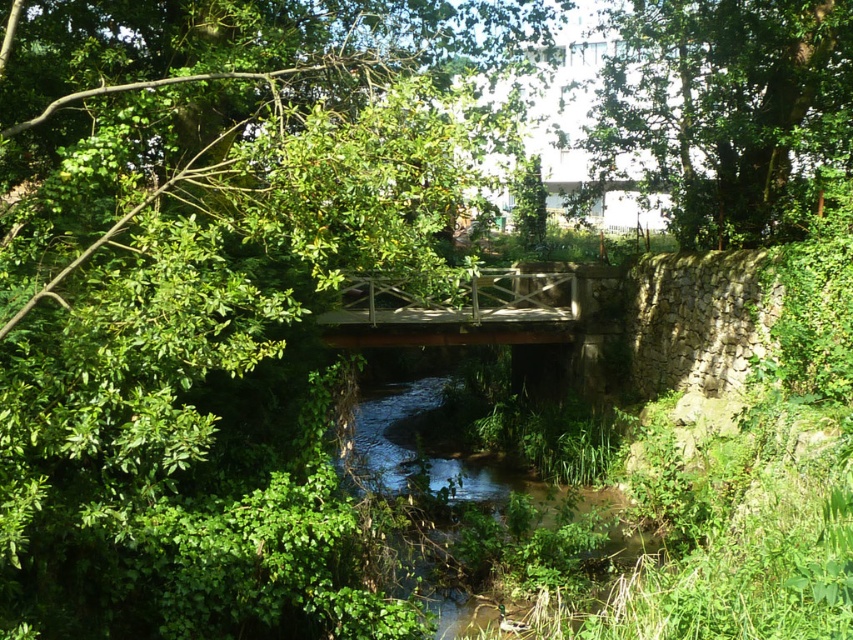
Does point (22, 44) come in front of point (761, 61)?

Yes.

Is green leafy tree at center below green leafy tree at upper center?

Indeed, green leafy tree at center is positioned under green leafy tree at upper center.

Is point (131, 1) closer to camera compared to point (637, 147)?

Yes, it is.

At what (x,y) coordinates should I click in order to perform the action: click on green leafy tree at center. Please return your answer as a coordinate pair (x, y). Image resolution: width=853 pixels, height=640 pixels. Looking at the image, I should click on (210, 291).

Does green leafy tree at upper center have a greater width compared to wooden bridge at center?

No, green leafy tree at upper center is not wider than wooden bridge at center.

Which is above, green leafy tree at upper center or wooden bridge at center?

Positioned higher is green leafy tree at upper center.

Describe the element at coordinates (730, 109) in the screenshot. The height and width of the screenshot is (640, 853). I see `green leafy tree at upper center` at that location.

At what (x,y) coordinates should I click in order to perform the action: click on green leafy tree at upper center. Please return your answer as a coordinate pair (x, y). Looking at the image, I should click on (730, 109).

Can you confirm if green leafy tree at center is positioned below wooden bridge at center?

Incorrect, green leafy tree at center is not positioned below wooden bridge at center.

Can you confirm if green leafy tree at center is positioned above wooden bridge at center?

Indeed, green leafy tree at center is positioned over wooden bridge at center.

Between point (204, 44) and point (556, 307), which one is positioned in front?

Point (204, 44)

Identify the location of green leafy tree at center. (210, 291).